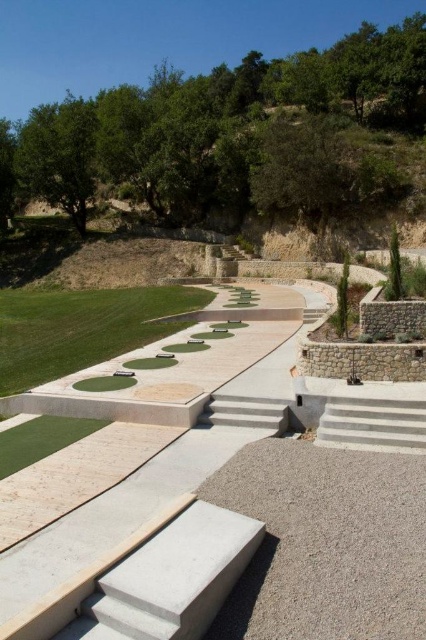
You are standing at the origin point of the coordinate system in the image. You need to place a new target 1 meter north of the green artificial turf at lower left. What are the coordinates of the new target location?

The coordinates of the new target location would be approximately at point (x=40, y=440) minus 1 meter north. However, without knowing the scale of the coordinate system, we can only state the relative position as north of the green artificial turf at lower left.

You are standing at the bottom of the white concrete stairs at lower right and want to walk to the green artificial turf at lower left. Which direction should you move to reach it?

The white concrete stairs at lower right is positioned on the right side of green artificial turf at lower left, so you should move to the left to reach the green artificial turf at lower left.